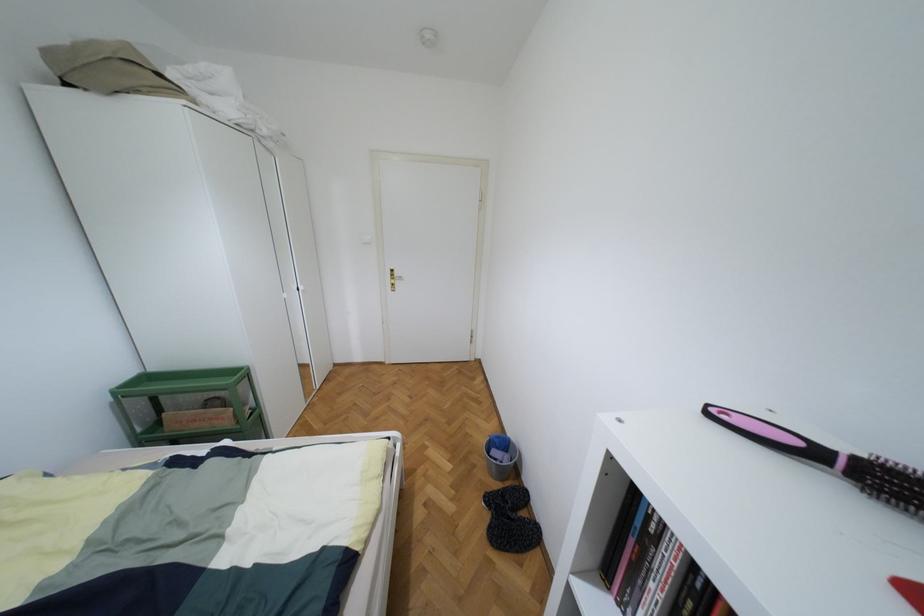
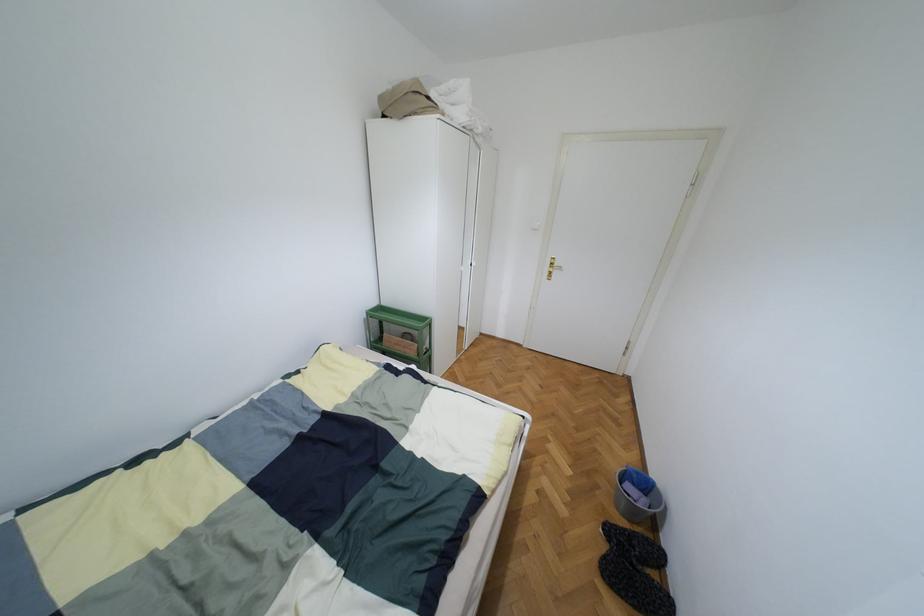
The point at (496, 437) is marked in the first image. Where is the corresponding point in the second image?

(638, 472)